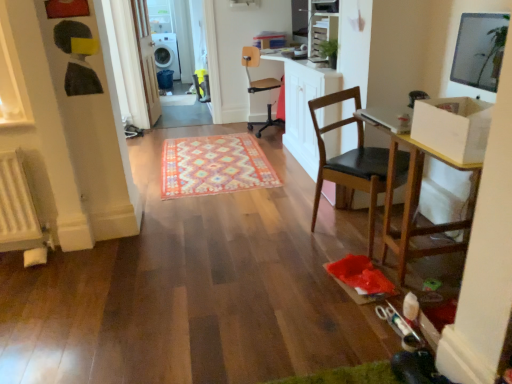
At what (x,y) coordinates should I click in order to perform the action: click on white glossy door at upper left. Please return your answer as a coordinate pair (x, y). This screenshot has height=384, width=512. Looking at the image, I should click on (146, 59).

Find the location of a particular element. The image size is (512, 384). black leather chair at center, which ranks as the 1th chair in bottom-to-top order is located at coordinates 350,162.

The width and height of the screenshot is (512, 384). What do you see at coordinates (214, 166) in the screenshot?
I see `multicolored woven rug at center` at bounding box center [214, 166].

Measure the distance between point (475,177) and camera.

Point (475,177) is 2.02 meters away from camera.

The image size is (512, 384). Describe the element at coordinates (416, 195) in the screenshot. I see `wooden table at right` at that location.

Locate an element on the screen. This screenshot has height=384, width=512. white glossy dishwasher at upper left is located at coordinates (166, 53).

Is beige leather office chair at center, the first chair from the back, spatially inside wooden table at right, or outside of it?

beige leather office chair at center, the first chair from the back, lies outside wooden table at right.

How many degrees apart are the facing directions of beige leather office chair at center, arranged as the 2th chair when ordered from the bottom, and wooden table at right?

The angle between the facing direction of beige leather office chair at center, arranged as the 2th chair when ordered from the bottom, and the facing direction of wooden table at right is 164 degrees.

Considering the relative positions of beige leather office chair at center, which is counted as the first chair, starting from the top, and wooden table at right in the image provided, is beige leather office chair at center, which is counted as the first chair, starting from the top, behind wooden table at right?

Yes, the depth of beige leather office chair at center, which is counted as the first chair, starting from the top, is greater than that of wooden table at right.

Looking at their sizes, would you say beige leather office chair at center, which is counted as the first chair, starting from the top, is wider or thinner than wooden table at right?

beige leather office chair at center, which is counted as the first chair, starting from the top, is thinner than wooden table at right.

From a real-world perspective, is white matte radiator at lower left above or below white glossy door at upper left?

Clearly, from a real-world perspective, white matte radiator at lower left is below white glossy door at upper left.

Is white matte radiator at lower left oriented towards white glossy door at upper left?

No, white matte radiator at lower left does not turn towards white glossy door at upper left.

Which object is wider, white matte radiator at lower left or white glossy door at upper left?

white glossy door at upper left is wider.

Is there a large distance between white matte radiator at lower left and white glossy door at upper left?

Yes, white matte radiator at lower left and white glossy door at upper left are located far from each other.

Are beige leather office chair at center, arranged as the 2th chair when ordered from the bottom, and white glossy dishwasher at upper left making contact?

No, beige leather office chair at center, arranged as the 2th chair when ordered from the bottom, is not next to white glossy dishwasher at upper left.

Does point (250, 86) lie in front of point (175, 77)?

Yes.

From a real-world perspective, does beige leather office chair at center, the first chair from the back, stand above white glossy dishwasher at upper left?

Correct, in the physical world, beige leather office chair at center, the first chair from the back, is higher than white glossy dishwasher at upper left.

Is beige leather office chair at center, the first chair from the back, completely or partially outside of white glossy dishwasher at upper left?

Absolutely, beige leather office chair at center, the first chair from the back, is external to white glossy dishwasher at upper left.

In the image, is black leather chair at center, marked as the 1th chair in a front-to-back arrangement, on the left side or the right side of wooden table at right?

Based on their positions, black leather chair at center, marked as the 1th chair in a front-to-back arrangement, is located to the left of wooden table at right.

From the picture: Are black leather chair at center, which ranks as the 1th chair in bottom-to-top order, and wooden table at right located far from each other?

No, black leather chair at center, which ranks as the 1th chair in bottom-to-top order, is not far from wooden table at right.

Is black leather chair at center, which ranks as the 1th chair in bottom-to-top order, facing towards wooden table at right?

Yes, black leather chair at center, which ranks as the 1th chair in bottom-to-top order, is facing wooden table at right.

Is point (324, 147) positioned behind point (394, 138)?

That is True.

Does beige leather office chair at center, which appears as the 2th chair when viewed from the front, have a greater height compared to white matte radiator at lower left?

Indeed, beige leather office chair at center, which appears as the 2th chair when viewed from the front, has a greater height compared to white matte radiator at lower left.

From the image's perspective, is beige leather office chair at center, which appears as the 2th chair when viewed from the front, over white matte radiator at lower left?

Indeed, from the image's perspective, beige leather office chair at center, which appears as the 2th chair when viewed from the front, is shown above white matte radiator at lower left.

Considering the positions of point (267, 85) and point (1, 165), is point (267, 85) closer or farther from the camera than point (1, 165)?

Point (267, 85) is farther from the camera than point (1, 165).

Is beige leather office chair at center, which is counted as the first chair, starting from the top, oriented away from white matte radiator at lower left?

No, beige leather office chair at center, which is counted as the first chair, starting from the top, is not facing away from white matte radiator at lower left.

Can you confirm if white glossy door at upper left is taller than wooden table at right?

Yes.

Can you confirm if white glossy door at upper left is thinner than wooden table at right?

Yes, white glossy door at upper left is thinner than wooden table at right.

Which object is further away from the camera, white glossy door at upper left or wooden table at right?

white glossy door at upper left is further away from the camera.

How far apart are white glossy door at upper left and wooden table at right?

The distance of white glossy door at upper left from wooden table at right is 3.46 meters.

Is white glossy door at upper left shorter than black leather chair at center, acting as the 2th chair starting from the top?

No, white glossy door at upper left is not shorter than black leather chair at center, acting as the 2th chair starting from the top.

From a real-world perspective, is white glossy door at upper left on black leather chair at center, acting as the 2th chair starting from the top?

Indeed, from a real-world perspective, white glossy door at upper left stands above black leather chair at center, acting as the 2th chair starting from the top.

Which of these two, white glossy door at upper left or black leather chair at center, which is the second chair from back to front, is wider?

Wider between the two is black leather chair at center, which is the second chair from back to front.

Does white glossy door at upper left come in front of black leather chair at center, marked as the 1th chair in a front-to-back arrangement?

No, the depth of white glossy door at upper left is greater than that of black leather chair at center, marked as the 1th chair in a front-to-back arrangement.

Image resolution: width=512 pixels, height=384 pixels. I want to click on table on the right of the beige leather office chair at center, which is counted as the first chair, starting from the top, so click(416, 195).

This screenshot has width=512, height=384. I want to click on radiator below the white glossy door at upper left (from the image's perspective), so click(x=18, y=207).

Which object lies nearer to the anchor point black leather chair at center, which ranks as the 1th chair in bottom-to-top order, beige leather office chair at center, arranged as the 2th chair when ordered from the bottom, or wooden table at right?

wooden table at right lies closer to black leather chair at center, which ranks as the 1th chair in bottom-to-top order, than the other object.

Looking at the image, which one is located further to white glossy dishwasher at upper left, black leather chair at center, acting as the 2th chair starting from the top, or multicolored woven rug at center?

black leather chair at center, acting as the 2th chair starting from the top, is positioned further to the anchor white glossy dishwasher at upper left.

Based on their spatial positions, is black leather chair at center, marked as the 1th chair in a front-to-back arrangement, or white glossy dishwasher at upper left closer to wooden table at right?

Based on the image, black leather chair at center, marked as the 1th chair in a front-to-back arrangement, appears to be nearer to wooden table at right.

When comparing their distances from wooden table at right, does beige leather office chair at center, which appears as the 2th chair when viewed from the front, or white glossy door at upper left seem closer?

The object closer to wooden table at right is beige leather office chair at center, which appears as the 2th chair when viewed from the front.

When comparing their distances from beige leather office chair at center, arranged as the 2th chair when ordered from the bottom, does wooden table at right or white matte radiator at lower left seem further?

white matte radiator at lower left is further to beige leather office chair at center, arranged as the 2th chair when ordered from the bottom.

Estimate the real-world distances between objects in this image. Which object is closer to black leather chair at center, acting as the 2th chair starting from the top, multicolored woven rug at center or wooden table at right?

wooden table at right lies closer to black leather chair at center, acting as the 2th chair starting from the top, than the other object.

From the image, which object appears to be nearer to multicolored woven rug at center, white glossy dishwasher at upper left or black leather chair at center, marked as the 1th chair in a front-to-back arrangement?

Based on the image, black leather chair at center, marked as the 1th chair in a front-to-back arrangement, appears to be nearer to multicolored woven rug at center.

When comparing their distances from white glossy door at upper left, does white glossy dishwasher at upper left or multicolored woven rug at center seem closer?

multicolored woven rug at center is positioned closer to the anchor white glossy door at upper left.

Find the location of a particular element. Image resolution: width=512 pixels, height=384 pixels. mat positioned between white matte radiator at lower left and white glossy dishwasher at upper left from near to far is located at coordinates (214, 166).

You are a GUI agent. You are given a task and a screenshot of the screen. Output one action in this format:
    pyautogui.click(x=<x>, y=<y>)
    Task: Click on the mat located between wooden table at right and white glossy dishwasher at upper left in the depth direction
    The image size is (512, 384).
    Given the screenshot: What is the action you would take?
    pyautogui.click(x=214, y=166)

The image size is (512, 384). Find the location of `chair located between white matte radiator at lower left and white glossy dishwasher at upper left in the depth direction`. chair located between white matte radiator at lower left and white glossy dishwasher at upper left in the depth direction is located at coordinates (260, 88).

Find the location of a particular element. mat positioned between wooden table at right and beige leather office chair at center, the first chair from the back, from near to far is located at coordinates (214, 166).